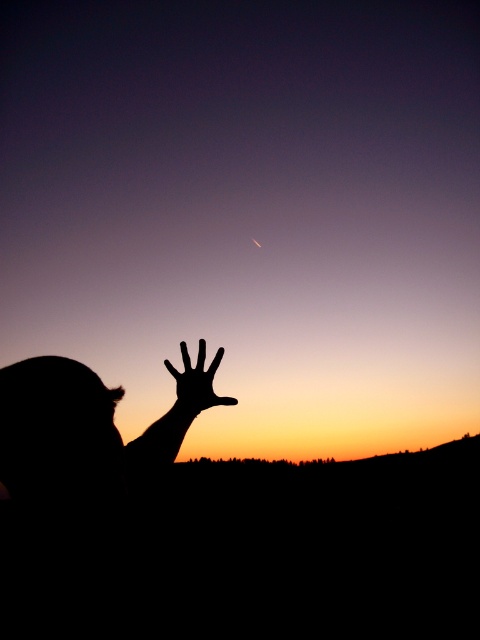
Question: Which point is closer to the camera?

Choices:
 (A) black matte hand at upper center
 (B) silvery reflective moon at center

Answer: (A)

Question: Which point appears closest to the camera in this image?

Choices:
 (A) (224, 401)
 (B) (252, 241)

Answer: (A)

Question: Does black matte hand at upper center appear under silvery reflective moon at center?

Choices:
 (A) no
 (B) yes

Answer: (B)

Question: Can you confirm if black matte hand at upper center is wider than silvery reflective moon at center?

Choices:
 (A) no
 (B) yes

Answer: (B)

Question: Can you confirm if black matte hand at upper center is positioned above silvery reflective moon at center?

Choices:
 (A) yes
 (B) no

Answer: (B)